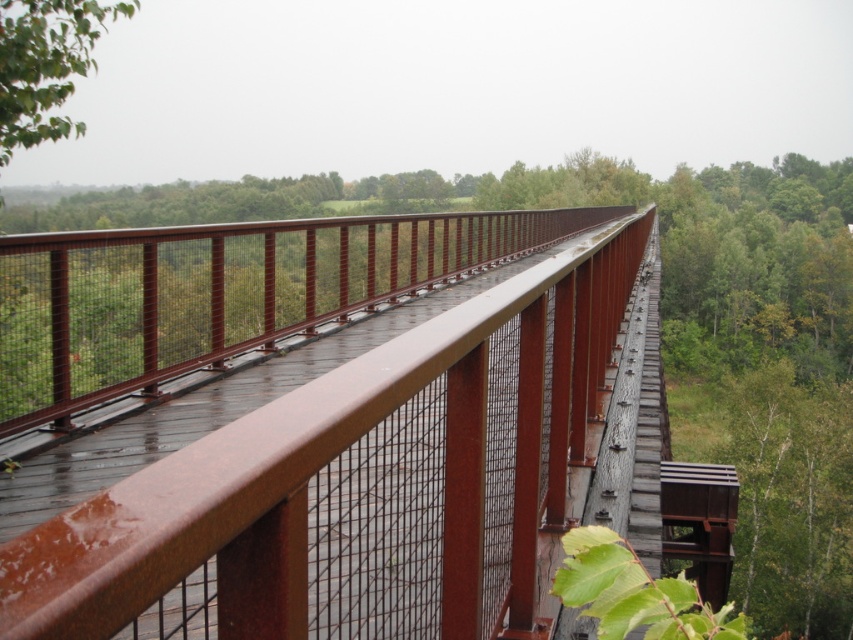
Question: Does rusty metal bridge at center appear under green matte tree at upper left?

Choices:
 (A) yes
 (B) no

Answer: (A)

Question: Observing the image, what is the correct spatial positioning of rusty metal bridge at center in reference to green matte tree at upper left?

Choices:
 (A) above
 (B) below

Answer: (B)

Question: Which of the following is the farthest from the observer?

Choices:
 (A) green matte tree at upper left
 (B) rusty metal bridge at center

Answer: (A)

Question: Among these points, which one is nearest to the camera?

Choices:
 (A) (404, 512)
 (B) (41, 17)

Answer: (A)

Question: Considering the relative positions of rusty metal bridge at center and green matte tree at upper left in the image provided, where is rusty metal bridge at center located with respect to green matte tree at upper left?

Choices:
 (A) left
 (B) right

Answer: (B)

Question: Which object is farther from the camera taking this photo?

Choices:
 (A) rusty metal bridge at center
 (B) green matte tree at upper left

Answer: (B)